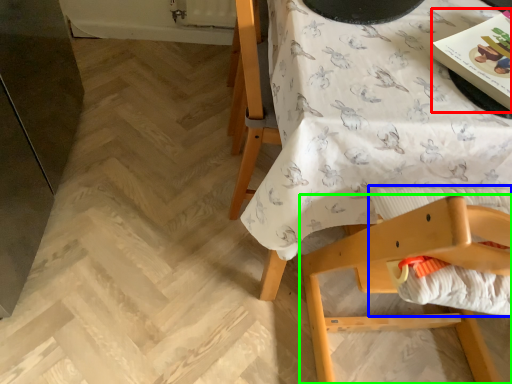
Question: Considering the real-world distances, which object is closest to magazine (highlighted by a red box)? sheet (highlighted by a blue box) or chair (highlighted by a green box).

Choices:
 (A) sheet
 (B) chair

Answer: (A)